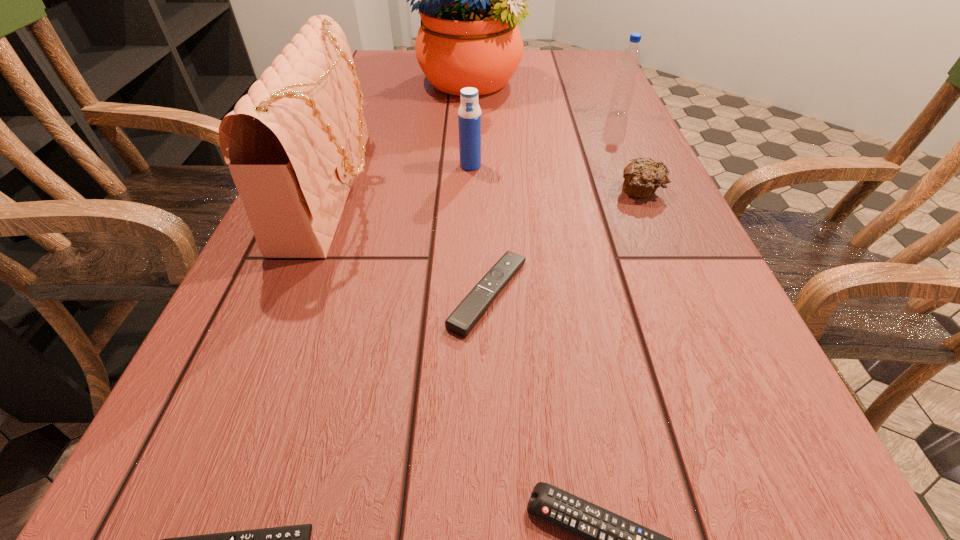
This screenshot has height=540, width=960. Find the location of `the farthest object`. the farthest object is located at coordinates (470, 0).

Locate an element on the screen. The height and width of the screenshot is (540, 960). the tallest object is located at coordinates (470, 0).

The width and height of the screenshot is (960, 540). What are the coordinates of `the seventh shortest object` in the screenshot? It's located at (293, 144).

This screenshot has height=540, width=960. I want to click on the seventh nearest object, so click(630, 60).

You are a GUI agent. You are given a task and a screenshot of the screen. Output one action in this format:
    pyautogui.click(x=<x>, y=<y>)
    Task: Click on the farther water bottle
    
    Given the screenshot: What is the action you would take?
    pyautogui.click(x=630, y=60)

The image size is (960, 540). In order to click on the nearer water bottle in this screenshot , I will do `click(469, 114)`.

The image size is (960, 540). Find the location of `muffin`. muffin is located at coordinates (642, 177).

At what (x,y) coordinates should I click in order to perform the action: click on the tallest remote control. Please return your answer as a coordinate pair (x, y). Looking at the image, I should click on (462, 320).

This screenshot has height=540, width=960. Find the location of `the farthest remote control`. the farthest remote control is located at coordinates (462, 320).

Locate an element on the screen. This screenshot has width=960, height=540. vacant space situated on the right of the tallest object is located at coordinates (608, 82).